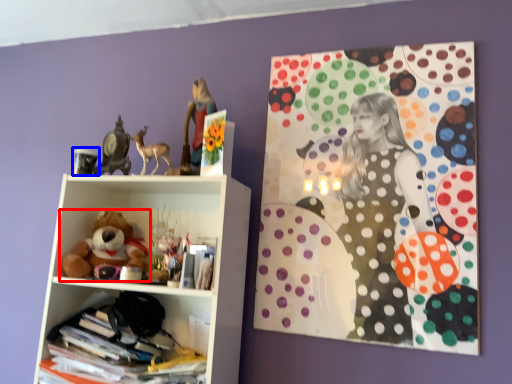
Question: Which of the following is the closest to the observer, teddy bear (highlighted by a red box) or toy (highlighted by a blue box)?

Choices:
 (A) teddy bear
 (B) toy

Answer: (A)